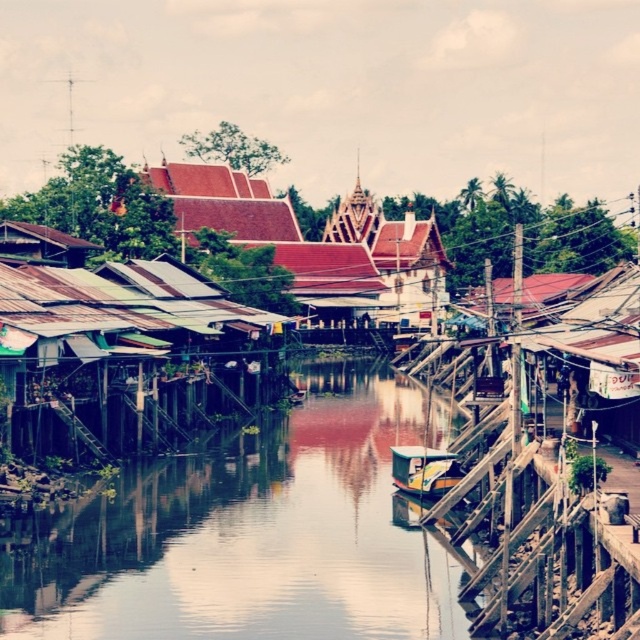
Question: Can you confirm if smooth concrete river at center is positioned to the right of green plastic boat at center?

Choices:
 (A) yes
 (B) no

Answer: (B)

Question: Is smooth concrete river at center bigger than green plastic boat at center?

Choices:
 (A) no
 (B) yes

Answer: (B)

Question: Which of the following is the farthest from the observer?

Choices:
 (A) smooth concrete river at center
 (B) green plastic boat at center

Answer: (B)

Question: Which of the following is the closest to the observer?

Choices:
 (A) green plastic boat at center
 (B) smooth concrete river at center

Answer: (B)

Question: Is smooth concrete river at center positioned in front of green plastic boat at center?

Choices:
 (A) yes
 (B) no

Answer: (A)